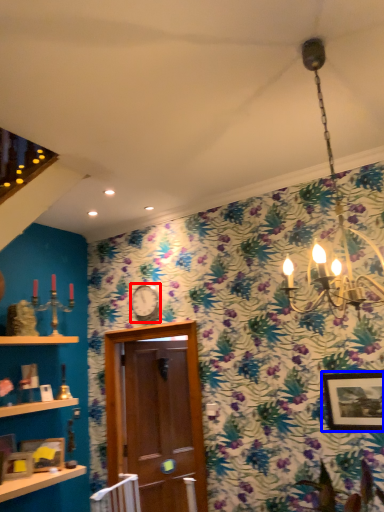
Question: Which of the following is the closest to the observer, clock (highlighted by a red box) or picture frame (highlighted by a blue box)?

Choices:
 (A) clock
 (B) picture frame

Answer: (B)